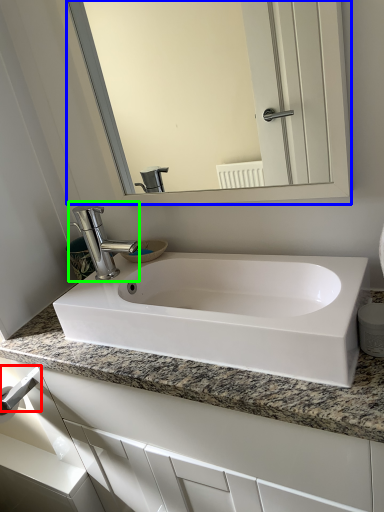
Question: Which is nearer to the towel bar (highlighted by a red box)? mirror (highlighted by a blue box) or tap (highlighted by a green box).

Choices:
 (A) mirror
 (B) tap

Answer: (B)